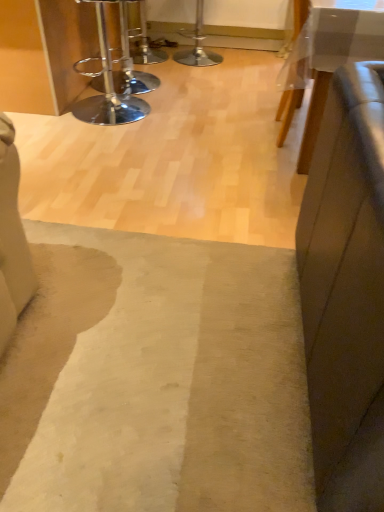
This screenshot has width=384, height=512. Describe the element at coordinates (107, 89) in the screenshot. I see `chrome/metallic bar stool at upper left` at that location.

Identify the location of white glossy table at upper right. (326, 61).

What is the approximate width of beige woolen mat at center?

beige woolen mat at center is 3.64 feet wide.

The image size is (384, 512). Identify the location of chrome/metallic bar stool at upper left. (107, 89).

Is white glossy table at upper right not close to chrome/metallic bar stool at upper left?

Absolutely, white glossy table at upper right is distant from chrome/metallic bar stool at upper left.

Is point (308, 62) positioned in front of point (82, 116)?

Yes, it is in front of point (82, 116).

How many degrees apart are the facing directions of white glossy table at upper right and chrome/metallic bar stool at upper left?

They differ by 91.2 degrees in their facing directions.

From the picture: Between white glossy table at upper right and chrome/metallic bar stool at upper left, which one is positioned behind?

Positioned behind is chrome/metallic bar stool at upper left.

Is beige woolen mat at center in front of or behind white glossy table at upper right in the image?

beige woolen mat at center is positioned closer to the viewer than white glossy table at upper right.

Considering the positions of objects beige woolen mat at center and white glossy table at upper right in the image provided, who is more to the left, beige woolen mat at center or white glossy table at upper right?

beige woolen mat at center.

Does beige woolen mat at center have a lesser width compared to white glossy table at upper right?

No, beige woolen mat at center is not thinner than white glossy table at upper right.

From a real-world perspective, is beige woolen mat at center positioned under white glossy table at upper right based on gravity?

Indeed, from a real-world perspective, beige woolen mat at center is positioned beneath white glossy table at upper right.

Considering the positions of objects chrome/metallic bar stool at upper left and beige woolen mat at center in the image provided, who is more to the left, chrome/metallic bar stool at upper left or beige woolen mat at center?

Positioned to the left is chrome/metallic bar stool at upper left.

Is chrome/metallic bar stool at upper left not inside beige woolen mat at center?

chrome/metallic bar stool at upper left is positioned outside beige woolen mat at center.

Which of these two, chrome/metallic bar stool at upper left or beige woolen mat at center, is bigger?

chrome/metallic bar stool at upper left.

From a real-world perspective, is chrome/metallic bar stool at upper left positioned above or below beige woolen mat at center?

Clearly, from a real-world perspective, chrome/metallic bar stool at upper left is above beige woolen mat at center.

Is metallic silver bar stool at upper center positioned with its back to white glossy table at upper right?

That's not correct — metallic silver bar stool at upper center is not looking away from white glossy table at upper right.

Is metallic silver bar stool at upper center far from white glossy table at upper right?

That's right, there is a large distance between metallic silver bar stool at upper center and white glossy table at upper right.

Based on their sizes in the image, would you say metallic silver bar stool at upper center is bigger or smaller than white glossy table at upper right?

metallic silver bar stool at upper center is smaller than white glossy table at upper right.

How different are the orientations of metallic silver bar stool at upper center and white glossy table at upper right in degrees?

They differ by 91.2 degrees in their facing directions.

Based on their sizes in the image, would you say metallic silver bar stool at upper center is bigger or smaller than chrome/metallic bar stool at upper left?

Considering their sizes, metallic silver bar stool at upper center takes up less space than chrome/metallic bar stool at upper left.

In the scene shown: Is metallic silver bar stool at upper center positioned with its back to chrome/metallic bar stool at upper left?

That's not correct — metallic silver bar stool at upper center is not looking away from chrome/metallic bar stool at upper left.

Is metallic silver bar stool at upper center situated inside chrome/metallic bar stool at upper left or outside?

metallic silver bar stool at upper center cannot be found inside chrome/metallic bar stool at upper left.

From the image's perspective, which one is positioned higher, metallic silver bar stool at upper center or chrome/metallic bar stool at upper left?

metallic silver bar stool at upper center, from the image's perspective.

The image size is (384, 512). I want to click on bar stool on the left of white glossy table at upper right, so click(x=143, y=38).

Choose the correct answer: Is white glossy table at upper right inside metallic silver bar stool at upper center or outside it?

white glossy table at upper right cannot be found inside metallic silver bar stool at upper center.

How different are the orientations of white glossy table at upper right and metallic silver bar stool at upper center in degrees?

91.2 degrees.

Would you say metallic silver bar stool at upper center is outside beige woolen mat at center?

Yes, metallic silver bar stool at upper center is not within beige woolen mat at center.

From the image's perspective, is metallic silver bar stool at upper center under beige woolen mat at center?

No, from the image's perspective, metallic silver bar stool at upper center is not beneath beige woolen mat at center.

Between metallic silver bar stool at upper center and beige woolen mat at center, which one appears on the left side from the viewer's perspective?

From the viewer's perspective, metallic silver bar stool at upper center appears more on the left side.

Between metallic silver bar stool at upper center and beige woolen mat at center, which one has larger size?

metallic silver bar stool at upper center.

At what (x,y) coordinates should I click in order to perform the action: click on stool on the left of white glossy table at upper right. Please return your answer as a coordinate pair (x, y). The height and width of the screenshot is (512, 384). Looking at the image, I should click on 107,89.

This screenshot has height=512, width=384. Find the location of `table located on the right of beige woolen mat at center`. table located on the right of beige woolen mat at center is located at coordinates (326, 61).

Estimate the real-world distances between objects in this image. Which object is further from chrome/metallic bar stool at upper left, beige woolen mat at center or metallic silver bar stool at upper center?

The object further to chrome/metallic bar stool at upper left is beige woolen mat at center.

Estimate the real-world distances between objects in this image. Which object is closer to white glossy table at upper right, beige woolen mat at center or metallic silver bar stool at upper center?

beige woolen mat at center.

Based on their spatial positions, is white glossy table at upper right or metallic silver bar stool at upper center further from chrome/metallic bar stool at upper left?

Among the two, white glossy table at upper right is located further to chrome/metallic bar stool at upper left.

When comparing their distances from metallic silver bar stool at upper center, does white glossy table at upper right or beige woolen mat at center seem closer?

white glossy table at upper right.

Estimate the real-world distances between objects in this image. Which object is further from metallic silver bar stool at upper center, chrome/metallic bar stool at upper left or white glossy table at upper right?

white glossy table at upper right lies further to metallic silver bar stool at upper center than the other object.

From the image, which object appears to be nearer to chrome/metallic bar stool at upper left, metallic silver bar stool at upper center or beige woolen mat at center?

The object closer to chrome/metallic bar stool at upper left is metallic silver bar stool at upper center.

Looking at the image, which one is located closer to beige woolen mat at center, metallic silver bar stool at upper center or chrome/metallic bar stool at upper left?

Based on the image, chrome/metallic bar stool at upper left appears to be nearer to beige woolen mat at center.

When comparing their distances from beige woolen mat at center, does chrome/metallic bar stool at upper left or white glossy table at upper right seem further?

The object further to beige woolen mat at center is chrome/metallic bar stool at upper left.

Where is `table positioned between beige woolen mat at center and metallic silver bar stool at upper center from near to far`? The width and height of the screenshot is (384, 512). table positioned between beige woolen mat at center and metallic silver bar stool at upper center from near to far is located at coordinates (326, 61).

You are a GUI agent. You are given a task and a screenshot of the screen. Output one action in this format:
    pyautogui.click(x=<x>, y=<y>)
    Task: Click on the stool positioned between white glossy table at upper right and metallic silver bar stool at upper center from near to far
    The image size is (384, 512).
    Given the screenshot: What is the action you would take?
    pyautogui.click(x=107, y=89)

At what (x,y) coordinates should I click in order to perform the action: click on stool between beige woolen mat at center and metallic silver bar stool at upper center in the front-back direction. Please return your answer as a coordinate pair (x, y). The width and height of the screenshot is (384, 512). Looking at the image, I should click on (107, 89).

Image resolution: width=384 pixels, height=512 pixels. I want to click on table between chrome/metallic bar stool at upper left and beige woolen mat at center in the vertical direction, so (326, 61).